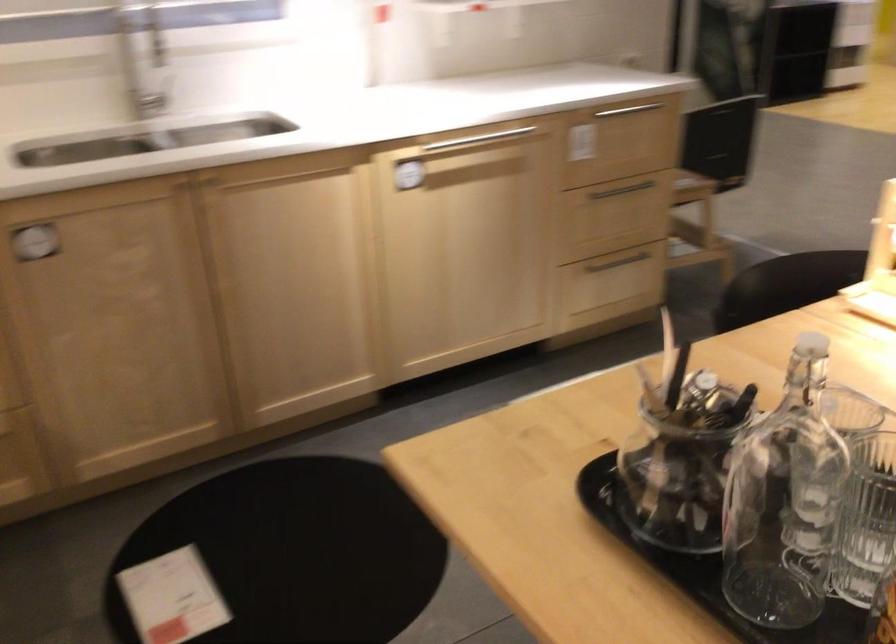
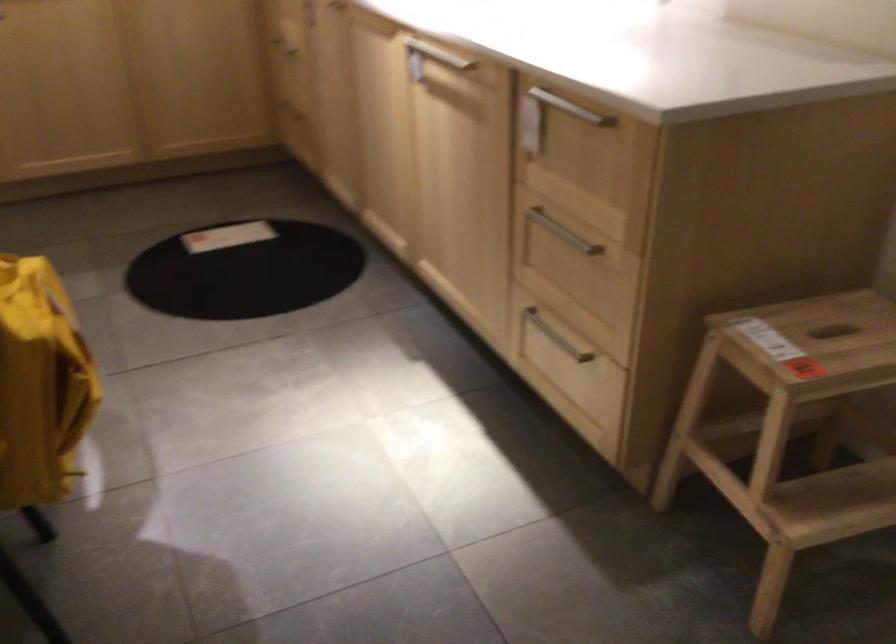
In the second image, find the point that corresponds to pixel 636 106 in the first image.

(570, 108)